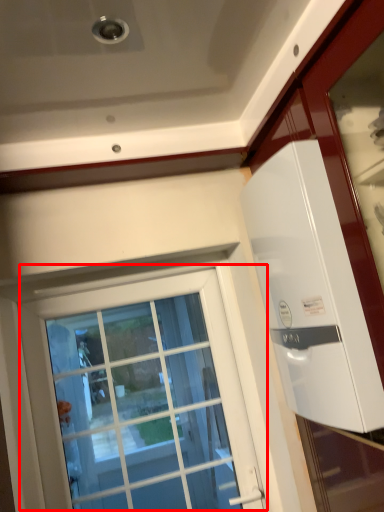
Question: Considering the relative positions of window (annotated by the red box) and appliance in the image provided, where is window (annotated by the red box) located with respect to the staircase?

Choices:
 (A) right
 (B) left

Answer: (B)